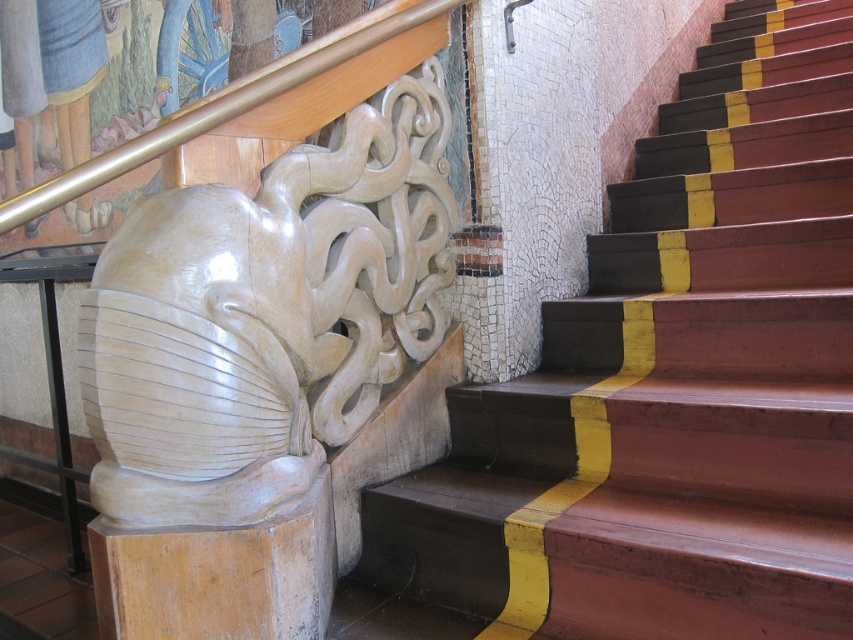
Question: Is wooden stairs at center smaller than gold polished metal handrail at upper left?

Choices:
 (A) no
 (B) yes

Answer: (A)

Question: Which of the following is the closest to the observer?

Choices:
 (A) (311, 157)
 (B) (529, 422)

Answer: (A)

Question: Which point is closer to the camera?

Choices:
 (A) (279, 81)
 (B) (804, 465)
 (C) (248, 477)

Answer: (C)

Question: Is the position of matte white sculpture at center less distant than that of gold polished metal handrail at upper left?

Choices:
 (A) yes
 (B) no

Answer: (B)

Question: Is matte white sculpture at center above gold polished metal handrail at upper left?

Choices:
 (A) no
 (B) yes

Answer: (A)

Question: Which point is farther to the camera?

Choices:
 (A) wooden stairs at center
 (B) gold polished metal handrail at upper left

Answer: (A)